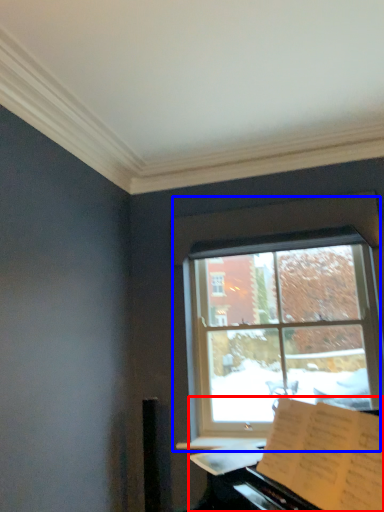
Question: Which of the following is the closest to the observer, piano (highlighted by a red box) or window (highlighted by a blue box)?

Choices:
 (A) piano
 (B) window

Answer: (A)